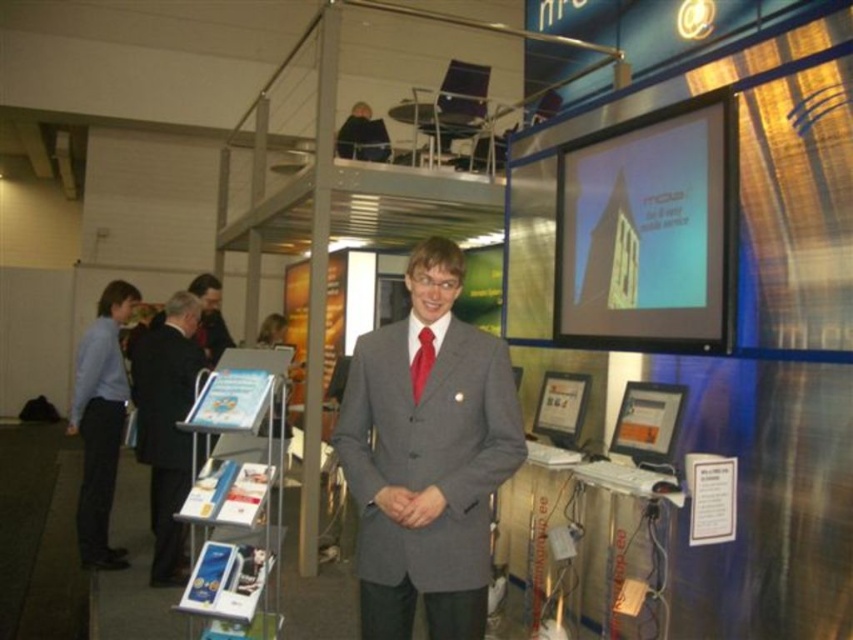
You are standing in the conference hall and want to move from point A to point B. Point A is at coordinates point (169, 298) and point B is at coordinates point (115, 458). Which point is closer to you?

Point A at coordinates point (169, 298) is closer to you than point B at coordinates point (115, 458) because it is further to the viewer.

You are a fashion designer observing the scene and need to determine which suit is more narrow between the gray wool suit at center and the dark gray suit at center. Which one is narrower?

The gray wool suit at center is narrower than the dark gray suit at center as it has a lesser width compared to the dark gray suit at center.

You are a photographer standing at the entrance of the conference hall. You need to capture a photo of both the gray wool suit at center and the dark gray suit at center in the same frame. Given that your camera has a focal length of 50mm and a field of view of 46 degrees, will you be able to include both subjects in the photo without moving closer or farther away?

The gray wool suit at center and dark gray suit at center are 2.25 meters apart. With a 50mm lens and a 46 degree field of view, the maximum distance between two objects that can be captured in the same frame can be calculated using trigonometry. The formula is distance between objects divided by 2 times the tangent of half the field of view angle. Plugging in the numbers, 2.25m divided by 2 times tan23 degrees equals approximately 2.25m divided by 0.424 equals about 5.3 meters. Since the subjects are only